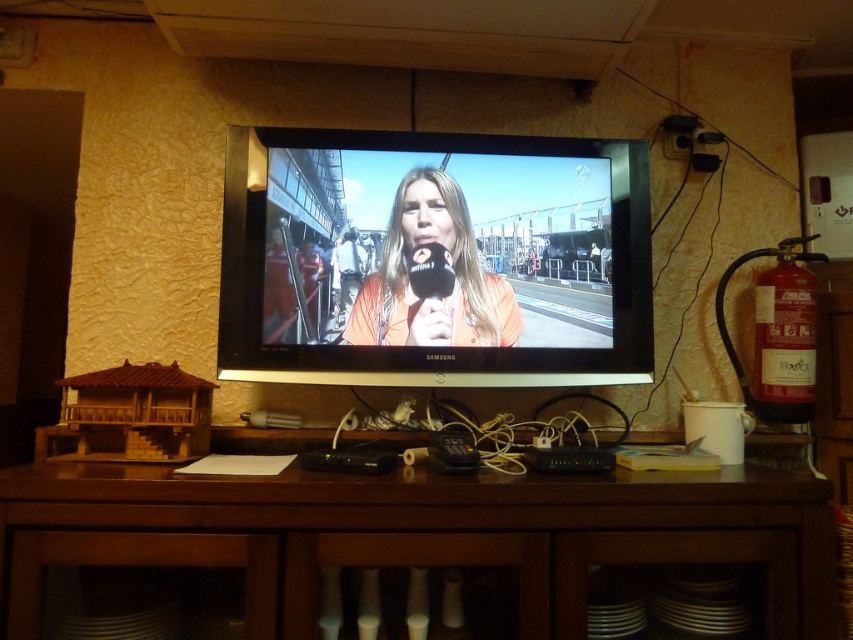
You are sitting on a couch facing the TV and want to grab the orange fabric microphone at center. Which direction should you move relative to the brown wood entertainment center at lower center?

The brown wood entertainment center at lower center is to the right of the orange fabric microphone at center. So, to reach the orange fabric microphone at center, you should move to the left relative to the brown wood entertainment center at lower center.